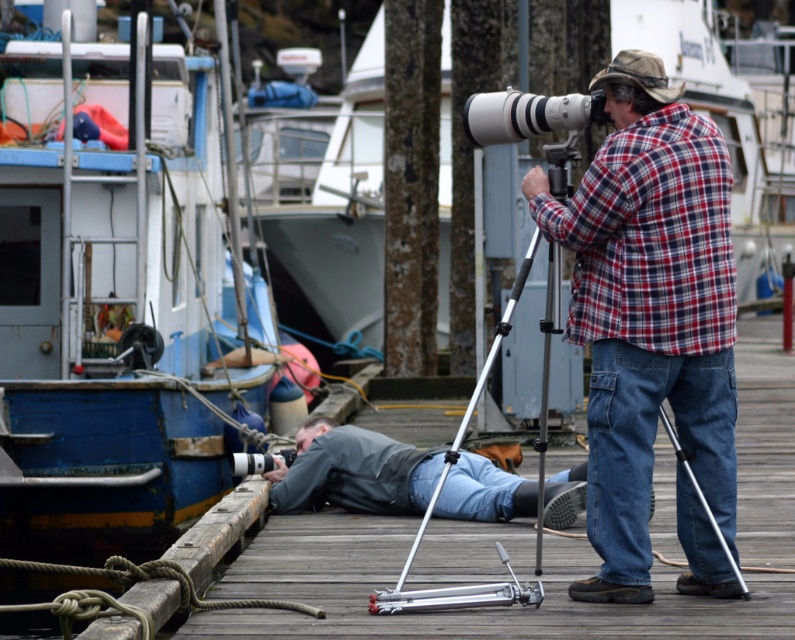
Question: Which of the following is the farthest from the observer?

Choices:
 (A) (113, 432)
 (B) (258, 138)
 (C) (592, 70)

Answer: (B)

Question: Does white glossy boat at upper center have a lesser width compared to silver metallic tripod at center?

Choices:
 (A) no
 (B) yes

Answer: (A)

Question: Which of these objects is positioned farthest from the white glossy boat at upper center?

Choices:
 (A) silver metallic camera at center
 (B) blue painted wood boat at left
 (C) plaid fabric at center
 (D) silver metallic tripod at center

Answer: (D)

Question: Which point is farther to the camera?

Choices:
 (A) (600, 84)
 (B) (409, 506)
 (C) (262, 452)
 (D) (568, 99)

Answer: (C)

Question: Does plaid fabric at center appear under white glossy boat at upper center?

Choices:
 (A) yes
 (B) no

Answer: (A)

Question: Is plaid fabric at center above silver metallic camera at center?

Choices:
 (A) yes
 (B) no

Answer: (B)